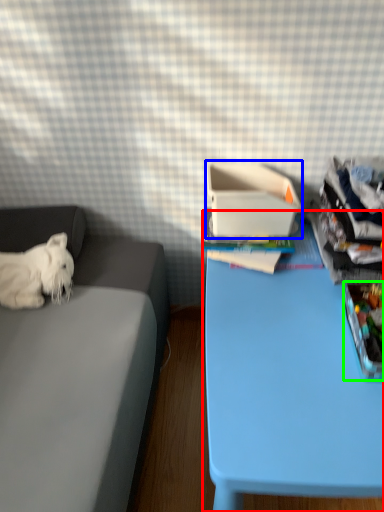
Question: Estimate the real-world distances between objects in this image. Which object is closer to table (highlighted by a red box), cardboard box (highlighted by a blue box) or storage box (highlighted by a green box)?

Choices:
 (A) cardboard box
 (B) storage box

Answer: (B)